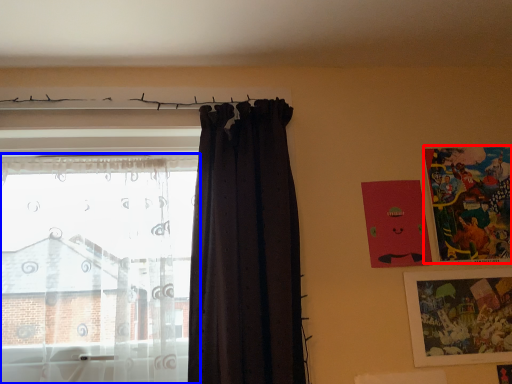
Question: Which of the following is the farthest to the observer, picture frame (highlighted by a red box) or curtain (highlighted by a blue box)?

Choices:
 (A) picture frame
 (B) curtain

Answer: (A)